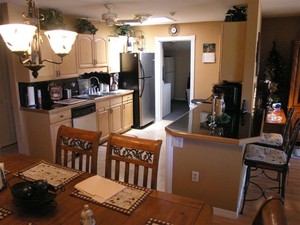
Where is `dishwasher`? The image size is (300, 225). dishwasher is located at coordinates (84, 118).